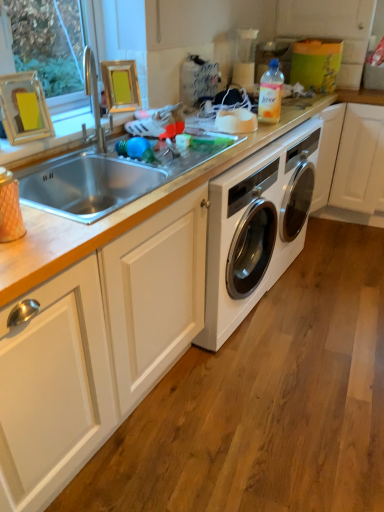
This screenshot has height=512, width=384. Identify the location of free spot to the right of white glossy washing machine at center. (343, 250).